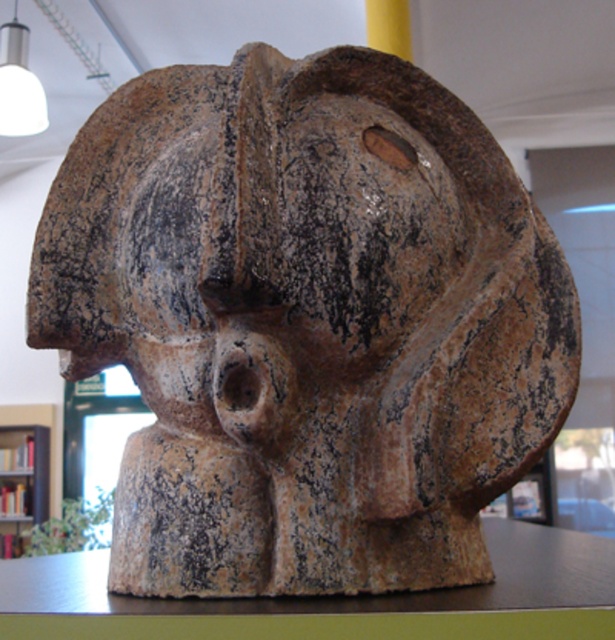
Question: Which point is farther from the camera taking this photo?

Choices:
 (A) (121, 618)
 (B) (4, 456)

Answer: (B)

Question: Among these objects, which one is nearest to the camera?

Choices:
 (A) wooden bookshelf at left
 (B) matte white bulb at upper left
 (C) brown wood table at center

Answer: (C)

Question: Is wooden bookshelf at left thinner than matte white bulb at upper left?

Choices:
 (A) yes
 (B) no

Answer: (B)

Question: From the image, what is the correct spatial relationship of brown wood table at center in relation to matte white bulb at upper left?

Choices:
 (A) right
 (B) left

Answer: (A)

Question: Which point appears closest to the camera in this image?

Choices:
 (A) (15, 472)
 (B) (608, 595)
 (C) (12, 100)

Answer: (B)

Question: Can you confirm if wooden bookshelf at left is positioned below matte white bulb at upper left?

Choices:
 (A) no
 (B) yes

Answer: (B)